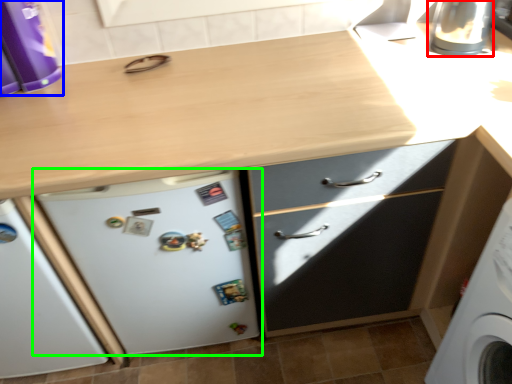
Question: Based on their relative distances, which object is farther from appliance (highlighted by a red box)? Choose from kitchen appliance (highlighted by a blue box) and refrigerator (highlighted by a green box).

Choices:
 (A) kitchen appliance
 (B) refrigerator

Answer: (A)